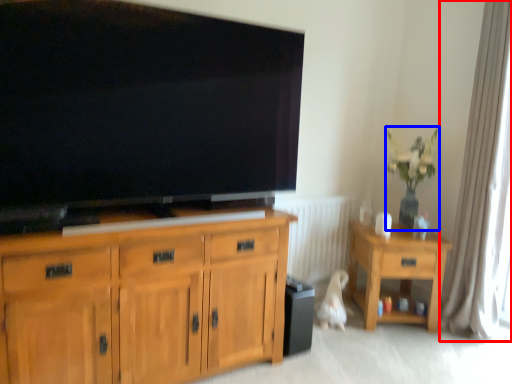
Question: Among these objects, which one is farthest to the camera, curtain (highlighted by a red box) or houseplant (highlighted by a blue box)?

Choices:
 (A) curtain
 (B) houseplant

Answer: (B)